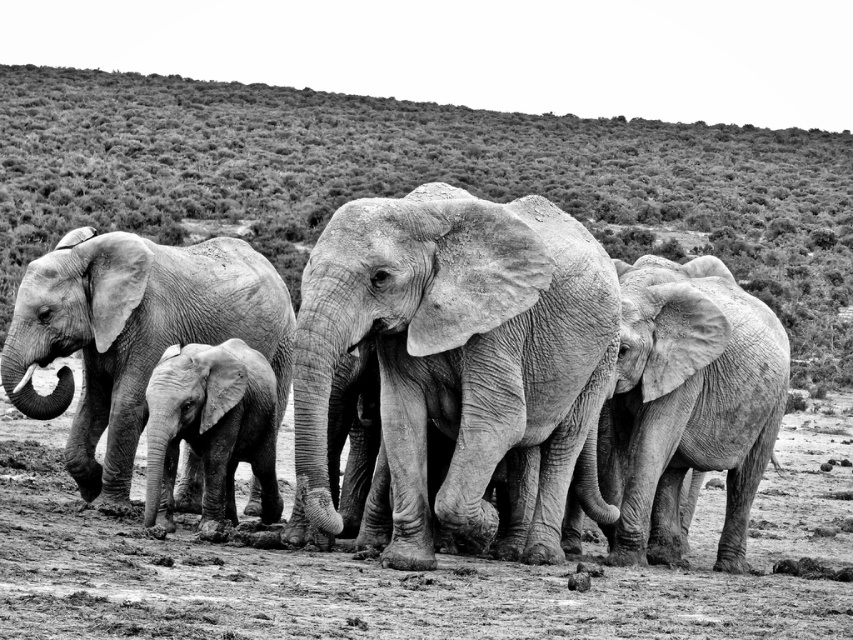
Between point (561, 291) and point (136, 522), which one is positioned in front?

Point (561, 291) is in front.

Measure the distance between gray textured elephants at center and dirt field at center.

gray textured elephants at center and dirt field at center are 4.80 meters apart from each other.

Which is behind, point (523, 342) or point (653, 582)?

The point (653, 582) is more distant.

At what (x,y) coordinates should I click in order to perform the action: click on gray textured elephants at center. Please return your answer as a coordinate pair (x, y). This screenshot has height=640, width=853. Looking at the image, I should click on (524, 371).

Can you confirm if gray textured elephants at center is wider than gray textured elephant at right?

Incorrect, gray textured elephants at center's width does not surpass gray textured elephant at right's.

Can you confirm if gray textured elephants at center is taller than gray textured elephant at right?

No, gray textured elephants at center is not taller than gray textured elephant at right.

Who is more forward, (671, 528) or (718, 326)?

Point (718, 326) is in front.

At what (x,y) coordinates should I click in order to perform the action: click on gray textured elephants at center. Please return your answer as a coordinate pair (x, y). Looking at the image, I should click on (524, 371).

Who is positioned more to the right, dirt field at center or gray textured baby elephant at center?

From the viewer's perspective, dirt field at center appears more on the right side.

Does point (103, 564) lie behind point (254, 426)?

That is False.

Which is in front, point (560, 579) or point (144, 506)?

Point (560, 579)

You are a GUI agent. You are given a task and a screenshot of the screen. Output one action in this format:
    pyautogui.click(x=<x>, y=<y>)
    Task: Click on the dirt field at center
    
    Given the screenshot: What is the action you would take?
    pyautogui.click(x=416, y=572)